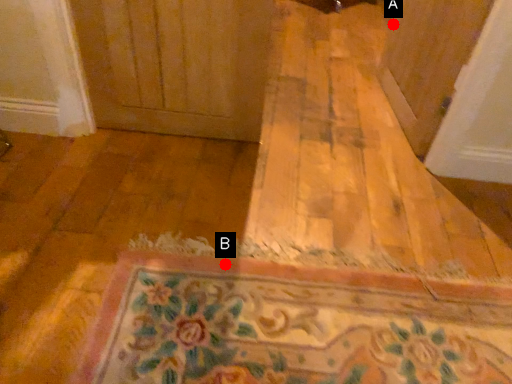
Question: Two points are circled on the image, labeled by A and B beside each circle. Which point is closer to the camera?

Choices:
 (A) A is closer
 (B) B is closer

Answer: (B)